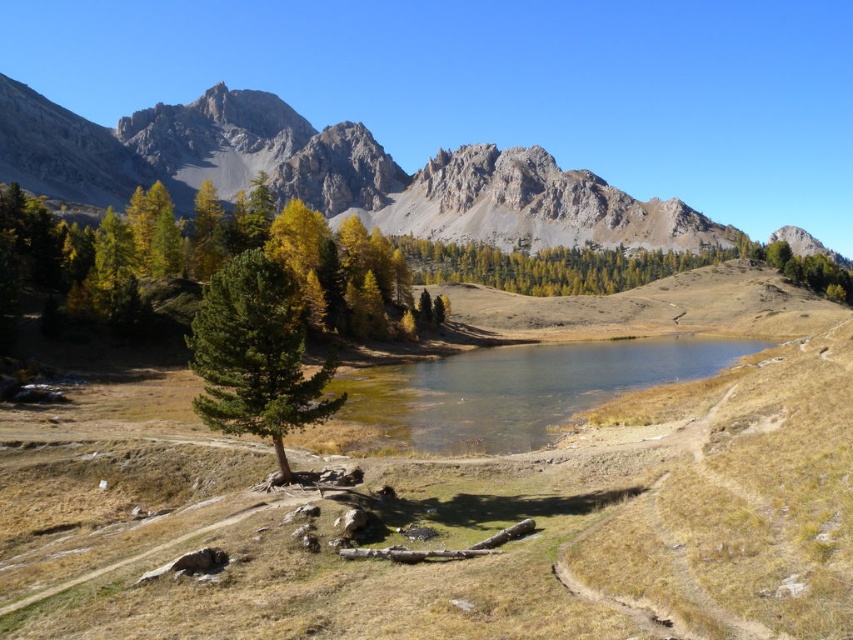
You are standing at the point marked by point (331, 172) in the image. Looking around, you see a rugged stone mountain to your left. Which direction should you walk to reach the lake in the foreground?

You should walk towards the right or downward direction because the rugged stone mountain is at upper left, so the lake is likely located in the opposite direction.